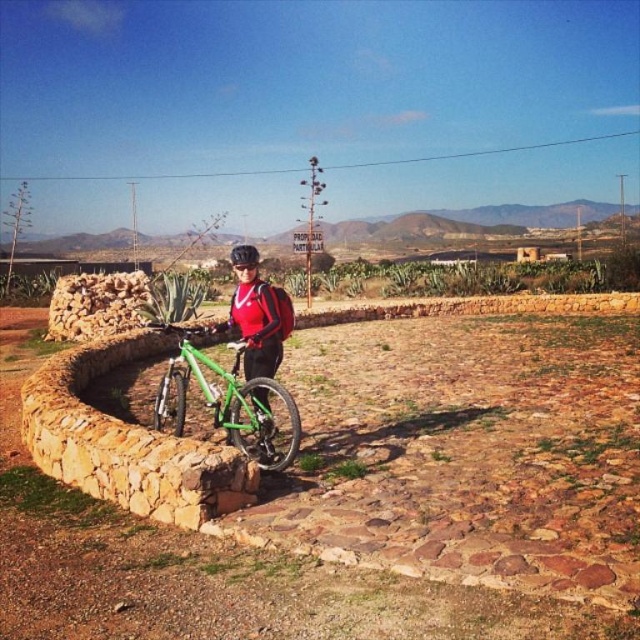
Question: Which point is farther to the camera?

Choices:
 (A) 240,244
 (B) 252,401
 (C) 241,308

Answer: (A)

Question: Which object is closer to the camera taking this photo?

Choices:
 (A) green matte bicycle at center
 (B) black matte bicycle helmet at center

Answer: (A)

Question: Which object appears closest to the camera in this image?

Choices:
 (A) green matte bicycle at center
 (B) black matte bicycle helmet at center
 (C) matte red jacket at center

Answer: (A)

Question: Is matte red jacket at center positioned before black matte bicycle helmet at center?

Choices:
 (A) yes
 (B) no

Answer: (A)

Question: Is the position of green matte bicycle at center more distant than that of matte red jacket at center?

Choices:
 (A) yes
 (B) no

Answer: (B)

Question: Is green matte bicycle at center positioned in front of black matte bicycle helmet at center?

Choices:
 (A) no
 (B) yes

Answer: (B)